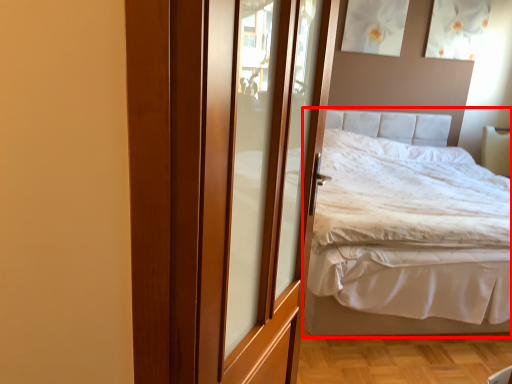
Question: In this image, where is bed (annotated by the red box) located relative to door?

Choices:
 (A) right
 (B) left

Answer: (A)